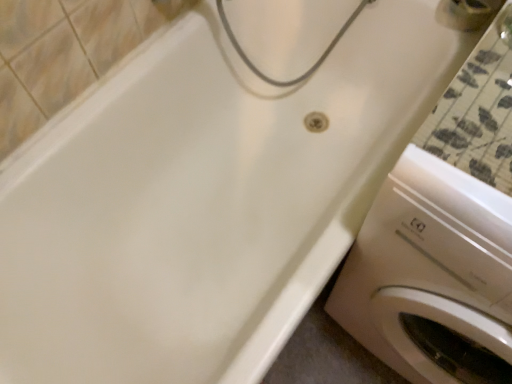
Question: Is white glossy washing machine at lower right spatially inside metallic silver faucet at upper right, or outside of it?

Choices:
 (A) outside
 (B) inside

Answer: (A)

Question: Relative to metallic silver faucet at upper right, is white glossy washing machine at lower right in front or behind?

Choices:
 (A) behind
 (B) front

Answer: (B)

Question: Is white glossy washing machine at lower right wider or thinner than metallic silver faucet at upper right?

Choices:
 (A) thin
 (B) wide

Answer: (B)

Question: Would you say metallic silver faucet at upper right is to the left or to the right of white glossy washing machine at lower right in the picture?

Choices:
 (A) right
 (B) left

Answer: (A)

Question: Would you say metallic silver faucet at upper right is inside or outside white glossy washing machine at lower right?

Choices:
 (A) inside
 (B) outside

Answer: (B)

Question: In terms of size, does metallic silver faucet at upper right appear bigger or smaller than white glossy washing machine at lower right?

Choices:
 (A) big
 (B) small

Answer: (B)

Question: From the image's perspective, is metallic silver faucet at upper right above or below white glossy washing machine at lower right?

Choices:
 (A) below
 (B) above

Answer: (B)